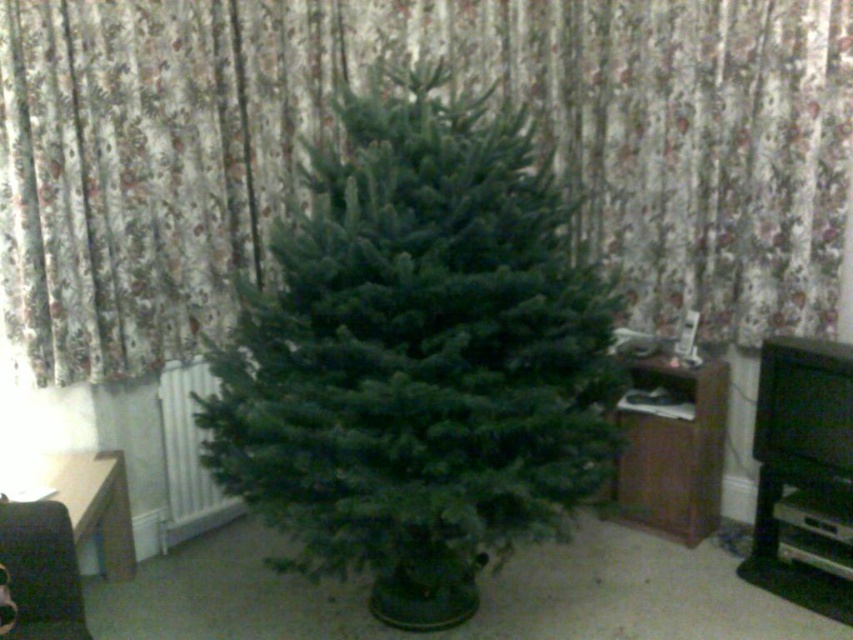
Question: Which object is farther from the camera taking this photo?

Choices:
 (A) green matte christmas tree at center
 (B) floral fabric curtain at center

Answer: (B)

Question: Does floral fabric curtain at center have a lesser width compared to green matte christmas tree at center?

Choices:
 (A) yes
 (B) no

Answer: (B)

Question: Which point is farther from the camera taking this photo?

Choices:
 (A) (717, 339)
 (B) (567, 381)

Answer: (A)

Question: Is floral fabric curtain at center thinner than green matte christmas tree at center?

Choices:
 (A) no
 (B) yes

Answer: (A)

Question: Which point is closer to the camera taking this photo?

Choices:
 (A) (22, 332)
 (B) (540, 184)

Answer: (B)

Question: In this image, where is floral fabric curtain at center located relative to green matte christmas tree at center?

Choices:
 (A) above
 (B) below

Answer: (A)